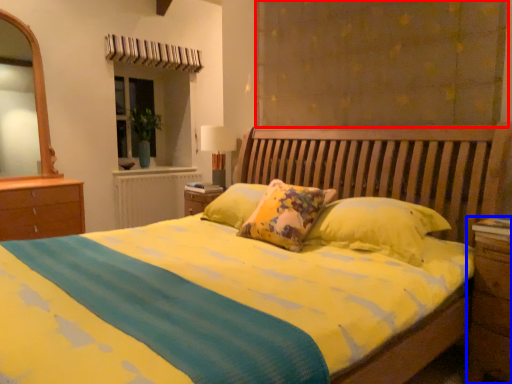
Question: Which object is further to the camera taking this photo, curtain (highlighted by a red box) or nightstand (highlighted by a blue box)?

Choices:
 (A) curtain
 (B) nightstand

Answer: (A)